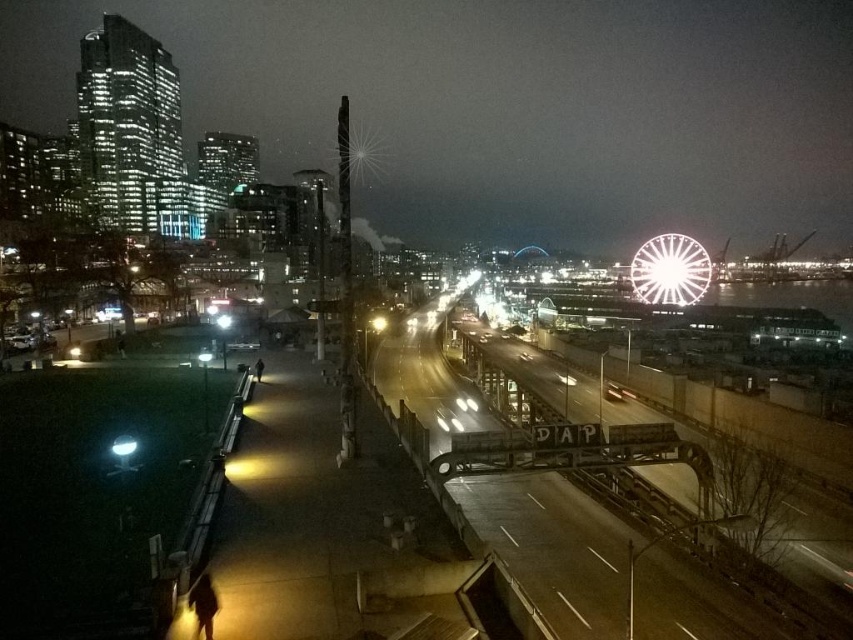
How far apart are metallic bridge at center and white metallic ferris wheel at upper right?

The distance of metallic bridge at center from white metallic ferris wheel at upper right is 312.80 feet.

Is metallic bridge at center to the left of white metallic ferris wheel at upper right from the viewer's perspective?

Yes, metallic bridge at center is to the left of white metallic ferris wheel at upper right.

Describe the element at coordinates (555, 547) in the screenshot. I see `metallic bridge at center` at that location.

Find the location of a particular element. The height and width of the screenshot is (640, 853). metallic bridge at center is located at coordinates (555, 547).